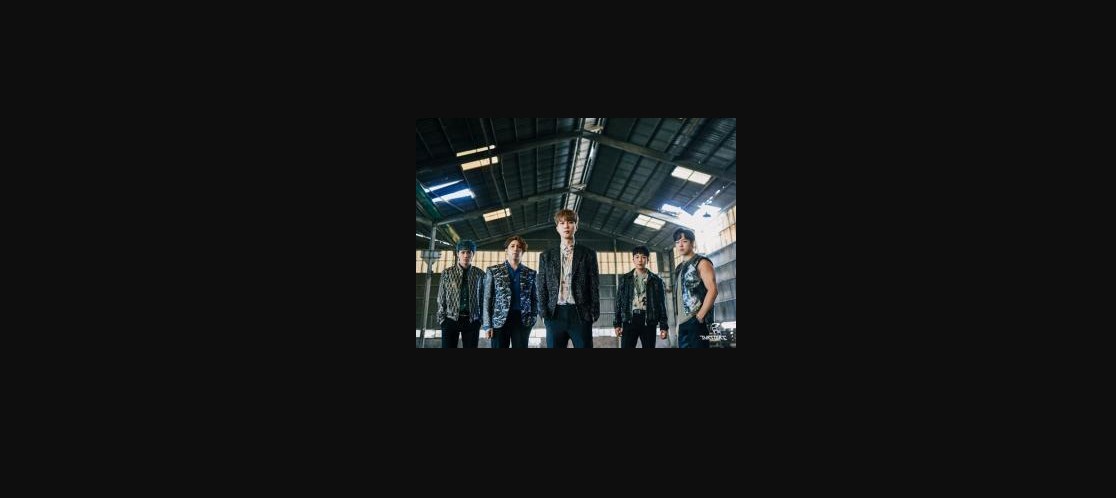
The width and height of the screenshot is (1116, 498). I want to click on windows, so click(x=730, y=230), click(x=609, y=258), click(x=529, y=258), click(x=490, y=261), click(x=497, y=215), click(x=479, y=161), click(x=698, y=178), click(x=648, y=222).